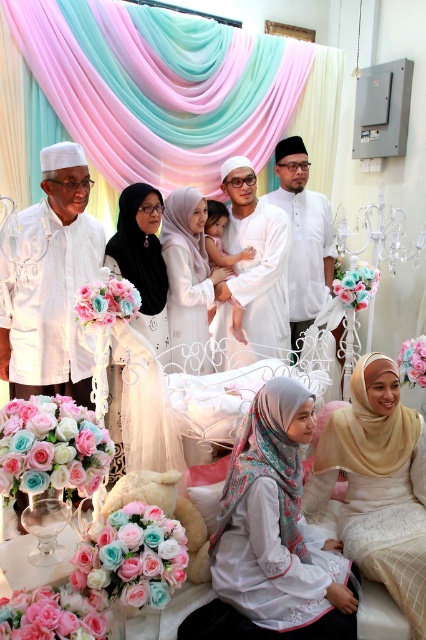
Question: Is white satin hijab at lower center further to camera compared to beige satin hijab at lower right?

Choices:
 (A) yes
 (B) no

Answer: (B)

Question: Which object is the farthest from the white matte/soft fabric at center?

Choices:
 (A) white matte shirt at left
 (B) beige satin hijab at lower right
 (C) white matte shirt at center

Answer: (B)

Question: Estimate the real-world distances between objects in this image. Which object is closer to the beige satin hijab at lower right?

Choices:
 (A) white matte shirt at center
 (B) white matte shirt at left

Answer: (A)

Question: Where is white matte shirt at left located in relation to matte white hijab at center in the image?

Choices:
 (A) right
 (B) left

Answer: (B)

Question: Which is farther from the beige satin hijab at lower right?

Choices:
 (A) white matte shirt at left
 (B) white matte shirt at center
 (C) white satin dress at center
 (D) white matte/soft fabric at center

Answer: (A)

Question: Does white satin dress at center have a greater width compared to white matte shirt at center?

Choices:
 (A) no
 (B) yes

Answer: (A)